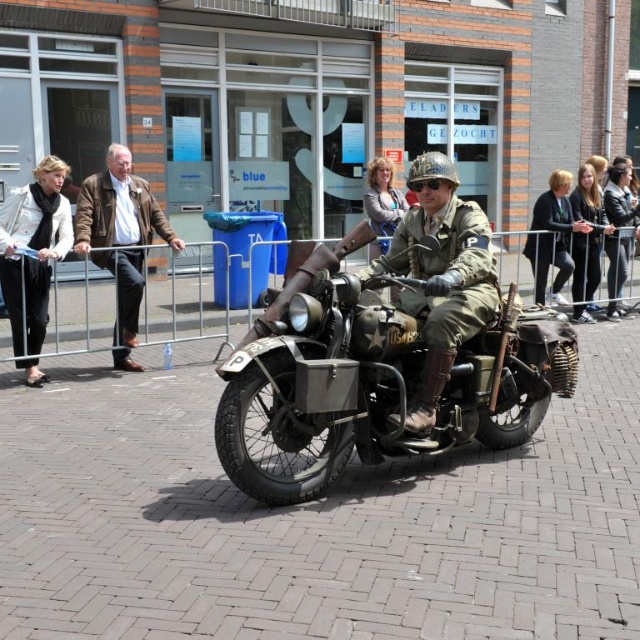
Question: Which point is closer to the camera taking this photo?

Choices:
 (A) (305, 360)
 (B) (125, 342)
 (C) (554, 280)

Answer: (A)

Question: From the image, what is the correct spatial relationship of matte olive green motorcycle at center in relation to white leather jacket at left?

Choices:
 (A) above
 (B) below

Answer: (B)

Question: Which object is positioned closest to the brown leather jacket at left?

Choices:
 (A) camouflage fabric jacket at center
 (B) green military uniform at center
 (C) white leather jacket at left
 (D) matte olive green motorcycle at center

Answer: (C)

Question: Does matte olive green motorcycle at center have a larger size compared to green military uniform at center?

Choices:
 (A) no
 (B) yes

Answer: (B)

Question: Considering the real-world distances, which object is farthest from the brown leather jacket at left?

Choices:
 (A) green military uniform at center
 (B) white leather jacket at left
 (C) camouflage fabric jacket at center
 (D) matte olive green motorcycle at center

Answer: (A)

Question: Is camouflage fabric jacket at center positioned at the back of green military uniform at center?

Choices:
 (A) no
 (B) yes

Answer: (A)